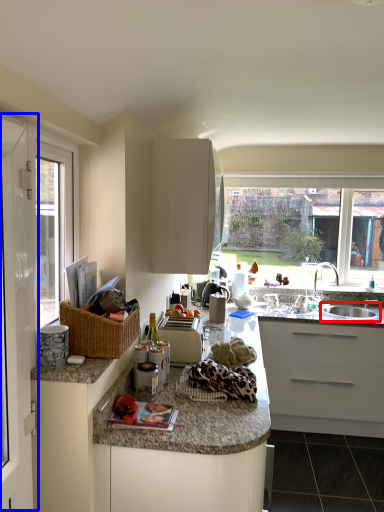
Question: Which object appears farthest to the camera in this image, sink (highlighted by a red box) or screen door (highlighted by a blue box)?

Choices:
 (A) sink
 (B) screen door

Answer: (A)